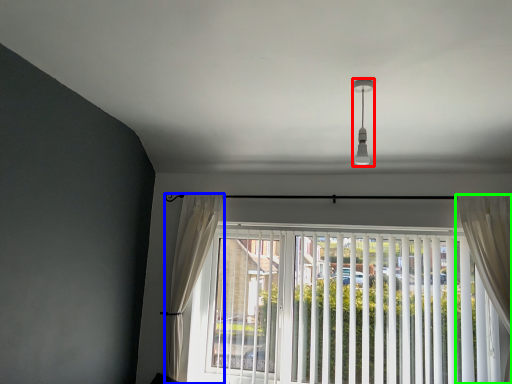
Question: Which object is positioned farthest from light fixture (highlighted by a red box)? Select from curtain (highlighted by a blue box) and curtain (highlighted by a green box).

Choices:
 (A) curtain
 (B) curtain

Answer: (A)